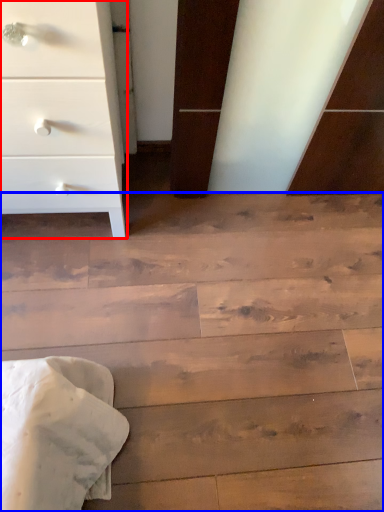
Question: Which object is closer to the camera taking this photo, chest of drawers (highlighted by a red box) or stairwell (highlighted by a blue box)?

Choices:
 (A) chest of drawers
 (B) stairwell

Answer: (A)